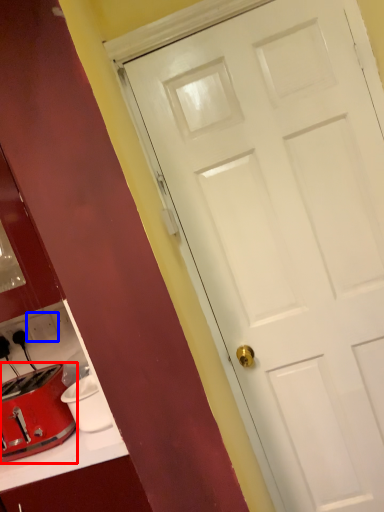
Question: Which point is further to the camera, toaster (highlighted by a red box) or electric outlet (highlighted by a blue box)?

Choices:
 (A) toaster
 (B) electric outlet

Answer: (B)